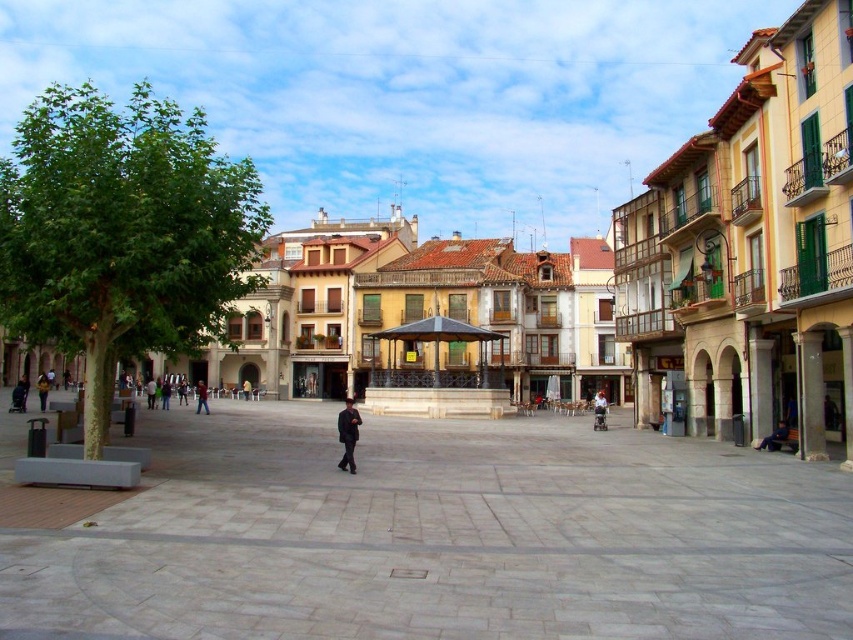
Which is more to the left, dark blue jeans at lower right or dark brown leather jacket at center?

From the viewer's perspective, dark brown leather jacket at center appears more on the left side.

Does dark blue jeans at lower right appear on the right side of dark brown leather jacket at center?

Yes, dark blue jeans at lower right is to the right of dark brown leather jacket at center.

You are a GUI agent. You are given a task and a screenshot of the screen. Output one action in this format:
    pyautogui.click(x=<x>, y=<y>)
    Task: Click on the dark blue jeans at lower right
    
    Given the screenshot: What is the action you would take?
    pyautogui.click(x=775, y=436)

Which is behind, point (251, 632) or point (39, 396)?

The point (39, 396) is behind.

Can you confirm if smooth concrete plaza at center is positioned to the right of dark brown leather jacket at lower left?

Indeed, smooth concrete plaza at center is positioned on the right side of dark brown leather jacket at lower left.

Which is in front, point (643, 541) or point (41, 410)?

Positioned in front is point (643, 541).

I want to click on smooth concrete plaza at center, so click(x=426, y=532).

Who is positioned more to the left, dark blue suit at center or dark brown leather jacket at lower left?

dark brown leather jacket at lower left

Does point (341, 468) lie behind point (41, 404)?

No, it is not.

Measure the distance between dark blue suit at center and camera.

53.75 meters

Locate an element on the screen. The height and width of the screenshot is (640, 853). dark blue suit at center is located at coordinates (347, 435).